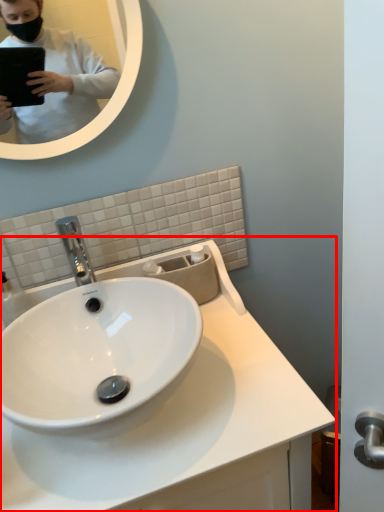
Question: From the image's perspective, what is the correct spatial relationship of sink (annotated by the red box) in relation to mirror?

Choices:
 (A) below
 (B) above

Answer: (A)